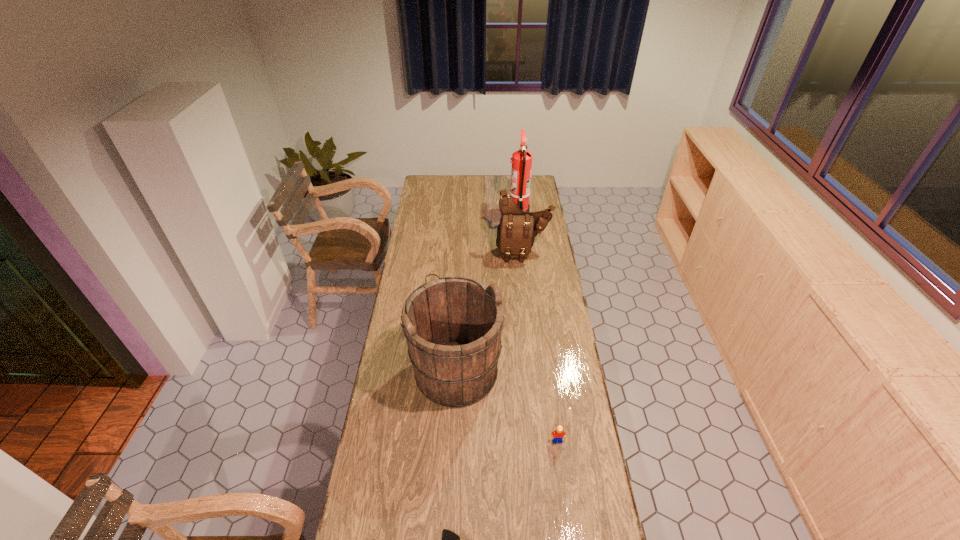
You are a GUI agent. You are given a task and a screenshot of the screen. Output one action in this format:
    pyautogui.click(x=<x>, y=<y>)
    Task: Click on the fire extinguisher
    
    Given the screenshot: What is the action you would take?
    pyautogui.click(x=521, y=161)

You are a GUI agent. You are given a task and a screenshot of the screen. Output one action in this format:
    pyautogui.click(x=<x>, y=<y>)
    Task: Click on the tallest object
    The height and width of the screenshot is (540, 960).
    Given the screenshot: What is the action you would take?
    (521, 161)

Locate an element on the screen. the second tallest object is located at coordinates (452, 325).

At what (x,y) coordinates should I click in order to perform the action: click on the third farthest object. Please return your answer as a coordinate pair (x, y). The width and height of the screenshot is (960, 540). Looking at the image, I should click on (452, 325).

Identify the location of shoulder bag. The image size is (960, 540). (517, 229).

Where is `the third tallest object`? the third tallest object is located at coordinates (517, 229).

Locate an element on the screen. the fourth tallest object is located at coordinates (559, 434).

Locate an element on the screen. The height and width of the screenshot is (540, 960). the fourth farthest object is located at coordinates (559, 434).

Image resolution: width=960 pixels, height=540 pixels. I want to click on free space located at the nozzle of the tallest object, so click(x=462, y=213).

Image resolution: width=960 pixels, height=540 pixels. Identify the location of vacant point located at the nozzle of the tallest object. (497, 213).